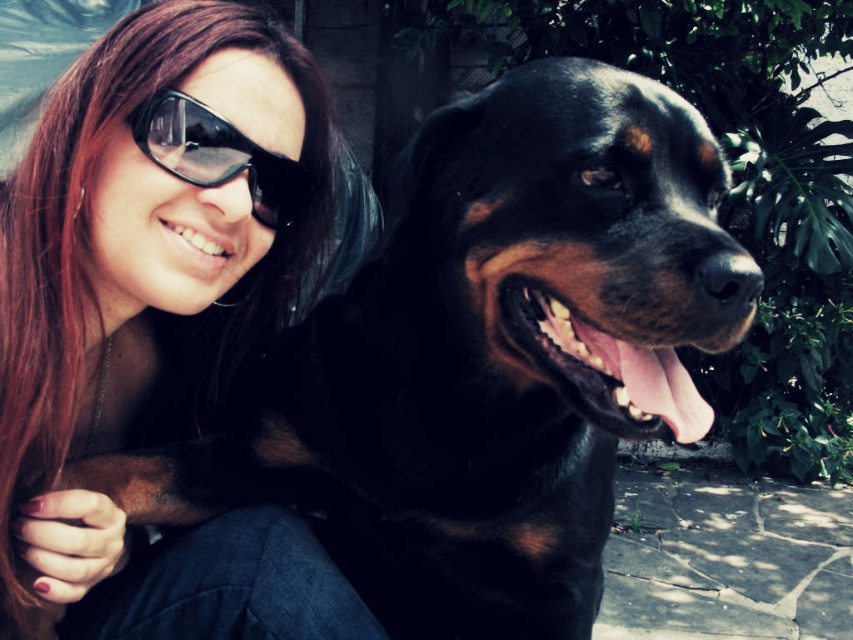
Question: Which of the following is the farthest from the observer?

Choices:
 (A) black plastic goggles at upper left
 (B) matte black hair at upper left

Answer: (A)

Question: Can you confirm if matte black hair at upper left is positioned to the left of black plastic goggles at upper left?

Choices:
 (A) yes
 (B) no

Answer: (A)

Question: Which point is closer to the camera?

Choices:
 (A) matte black hair at upper left
 (B) black plastic goggles at upper left

Answer: (A)

Question: Is matte black hair at upper left above black plastic goggles at upper left?

Choices:
 (A) yes
 (B) no

Answer: (B)

Question: Is matte black hair at upper left thinner than black plastic goggles at upper left?

Choices:
 (A) yes
 (B) no

Answer: (B)